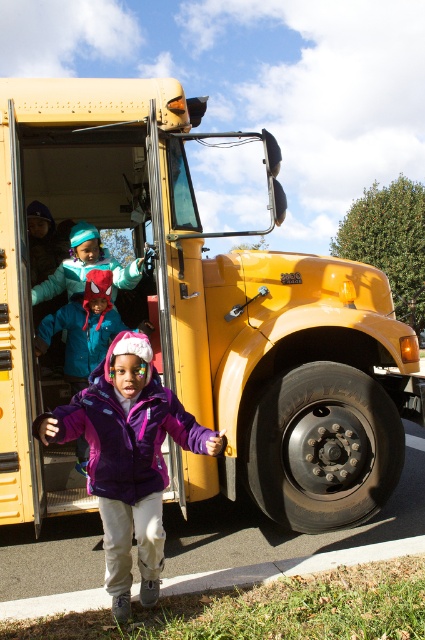
Does yellow matte school bus at center lie in front of purple fleece jacket at center?

No, yellow matte school bus at center is behind purple fleece jacket at center.

Is yellow matte school bus at center to the right of purple fleece jacket at center from the viewer's perspective?

Correct, you'll find yellow matte school bus at center to the right of purple fleece jacket at center.

Is point (200, 227) positioned behind point (122, 477)?

Yes, point (200, 227) is behind point (122, 477).

Identify the location of yellow matte school bus at center. (200, 317).